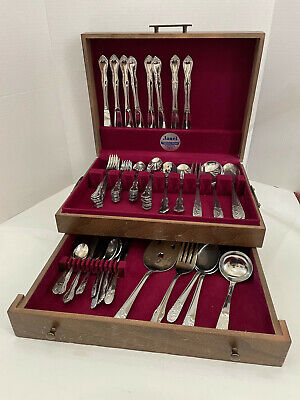
I want to click on knives, so click(x=104, y=94), click(x=116, y=93), click(x=126, y=93), click(x=134, y=92), click(x=149, y=89), click(x=158, y=89), click(x=175, y=88), click(x=185, y=89).